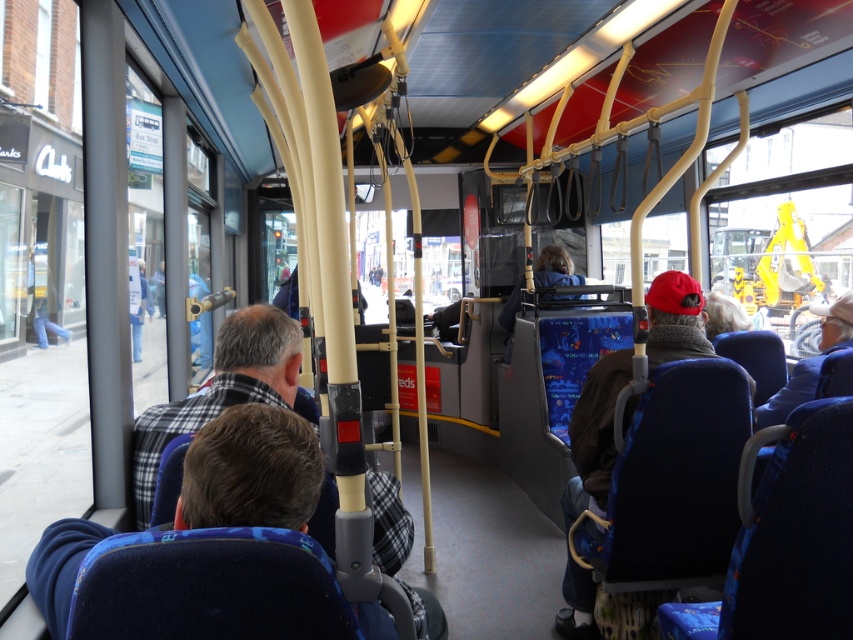
Who is positioned more to the left, plaid fabric coach at center or blue fabric jacket at right?

plaid fabric coach at center is more to the left.

The height and width of the screenshot is (640, 853). What are the coordinates of `plaid fabric coach at center` in the screenshot? It's located at 221,388.

Measure the distance between point [225,380] and camera.

Point [225,380] is 5.93 feet from camera.

At what (x,y) coordinates should I click in order to perform the action: click on plaid fabric coach at center. Please return your answer as a coordinate pair (x, y). Looking at the image, I should click on (221, 388).

Who is taller, red knit cap at right or blue fabric jacket at right?

red knit cap at right is taller.

Does red knit cap at right come behind blue fabric jacket at right?

That is False.

This screenshot has height=640, width=853. Identify the location of red knit cap at right. (595, 435).

Is plaid fabric coach at center wider than red knit cap at right?

Indeed, plaid fabric coach at center has a greater width compared to red knit cap at right.

What do you see at coordinates (221, 388) in the screenshot?
I see `plaid fabric coach at center` at bounding box center [221, 388].

What are the coordinates of `plaid fabric coach at center` in the screenshot? It's located at (221, 388).